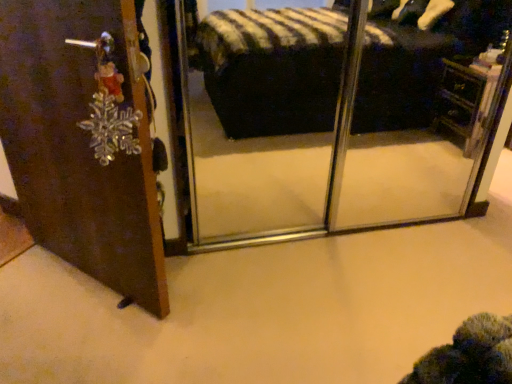
Find the location of a particular element. Image resolution: width=512 pixels, height=384 pixels. vacant area that is situated to the right of brown wooden door at left is located at coordinates (232, 281).